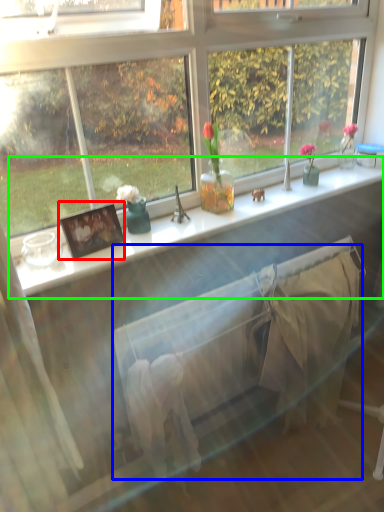
Question: Based on their relative distances, which object is nearer to picture frame (highlighted by a red box)? Choose from bed frame (highlighted by a blue box) and window sill (highlighted by a green box).

Choices:
 (A) bed frame
 (B) window sill

Answer: (B)